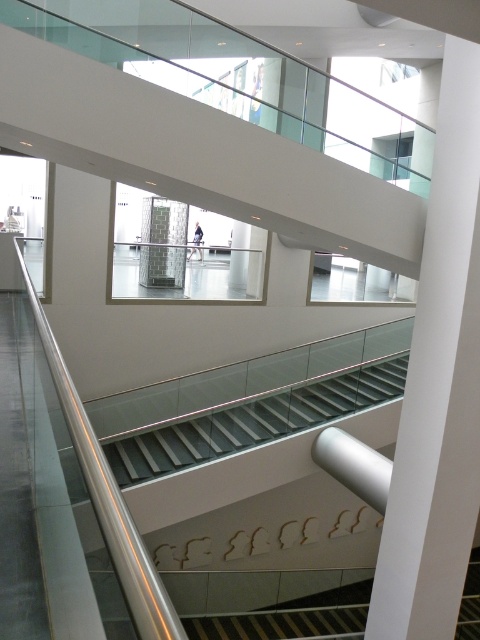
Does white smooth pillar at center appear on the left side of white glossy stair at center?

In fact, white smooth pillar at center is to the right of white glossy stair at center.

Is white smooth pillar at center to the right of white glossy stair at center from the viewer's perspective?

Correct, you'll find white smooth pillar at center to the right of white glossy stair at center.

What do you see at coordinates (439, 387) in the screenshot? I see `white smooth pillar at center` at bounding box center [439, 387].

Where is `white smooth pillar at center`? This screenshot has width=480, height=640. white smooth pillar at center is located at coordinates (439, 387).